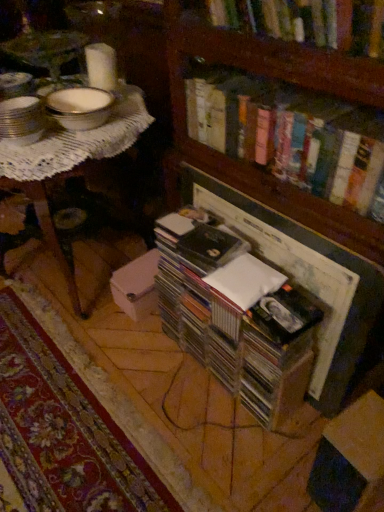
Identify the location of vacant area in front of white lace table at upper left. (115, 404).